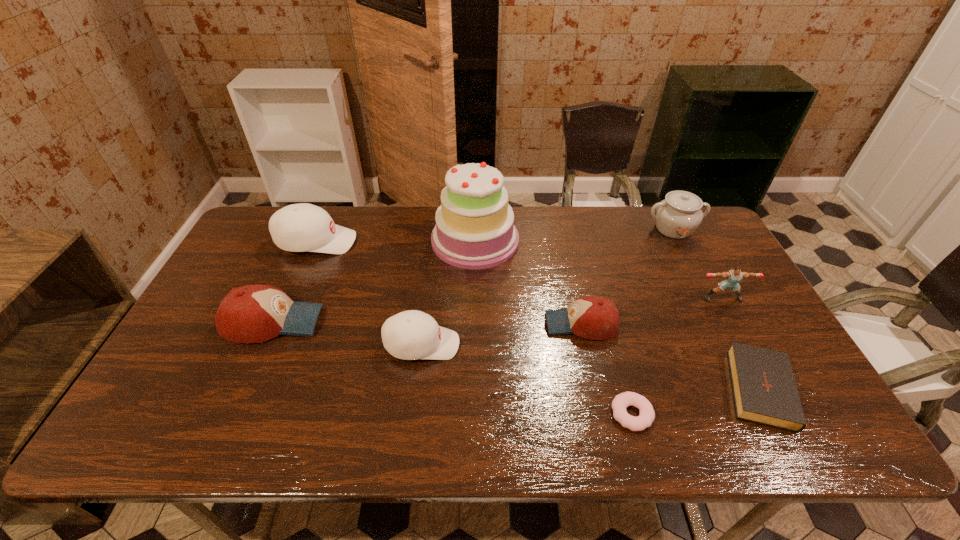
Locate an element on the screen. The width and height of the screenshot is (960, 540). the tallest object is located at coordinates (474, 229).

This screenshot has width=960, height=540. What are the coordinates of `purple cake` in the screenshot? It's located at (474, 229).

The height and width of the screenshot is (540, 960). I want to click on chinaware, so 677,216.

This screenshot has width=960, height=540. In order to click on the bigger white baseball cap in this screenshot , I will do `click(302, 227)`.

The width and height of the screenshot is (960, 540). I want to click on the left white baseball cap, so click(x=302, y=227).

Where is `red puncher`? red puncher is located at coordinates (734, 276).

Where is `the bigger red baseball cap`? the bigger red baseball cap is located at coordinates (256, 313).

Find the location of a particular element. The image size is (960, 540). the nearer white baseball cap is located at coordinates (410, 335).

What are the coordinates of `the second baseball cap from right to left` in the screenshot? It's located at (410, 335).

I want to click on the rightmost baseball cap, so click(x=591, y=317).